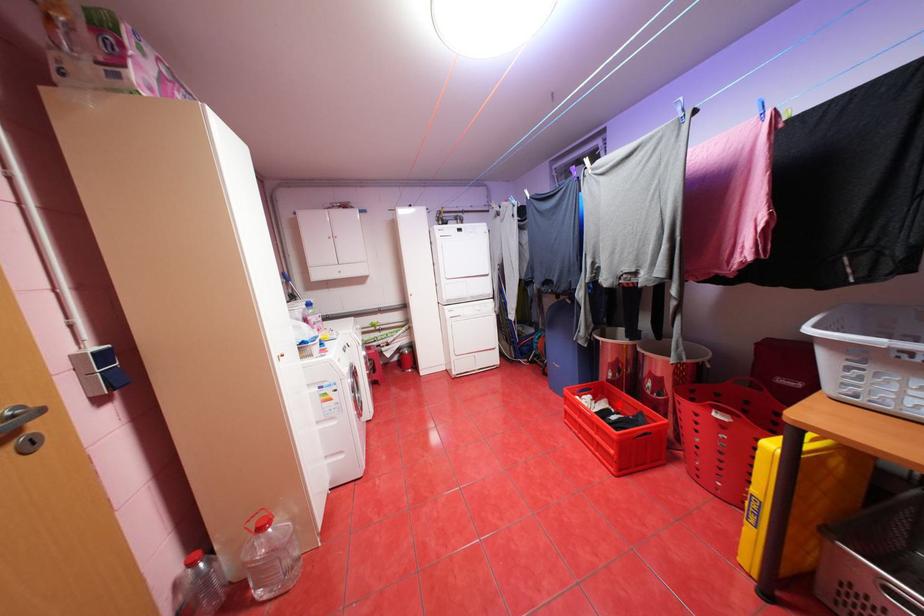
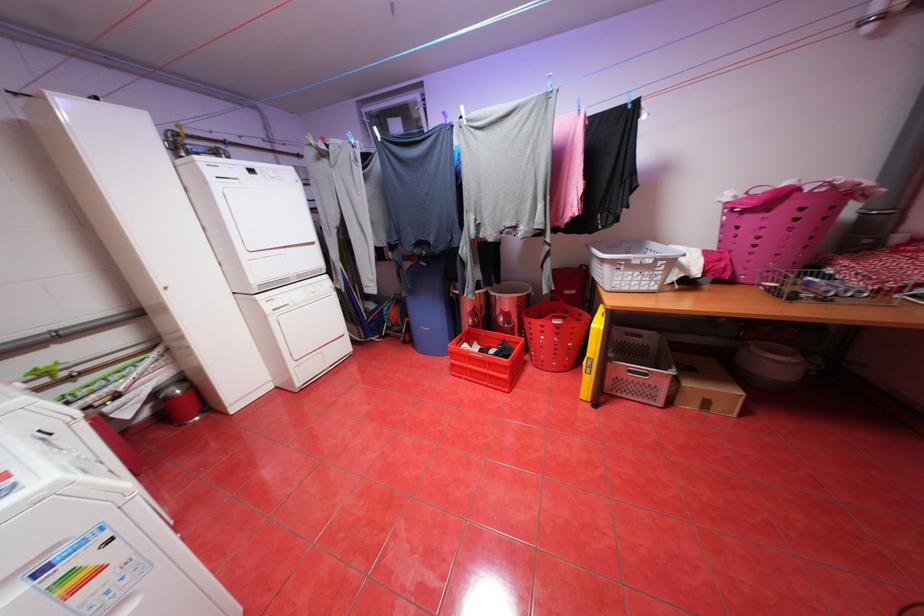
Locate, in the second image, the point that corresponds to the highlighted location in the first image.

(488, 344)